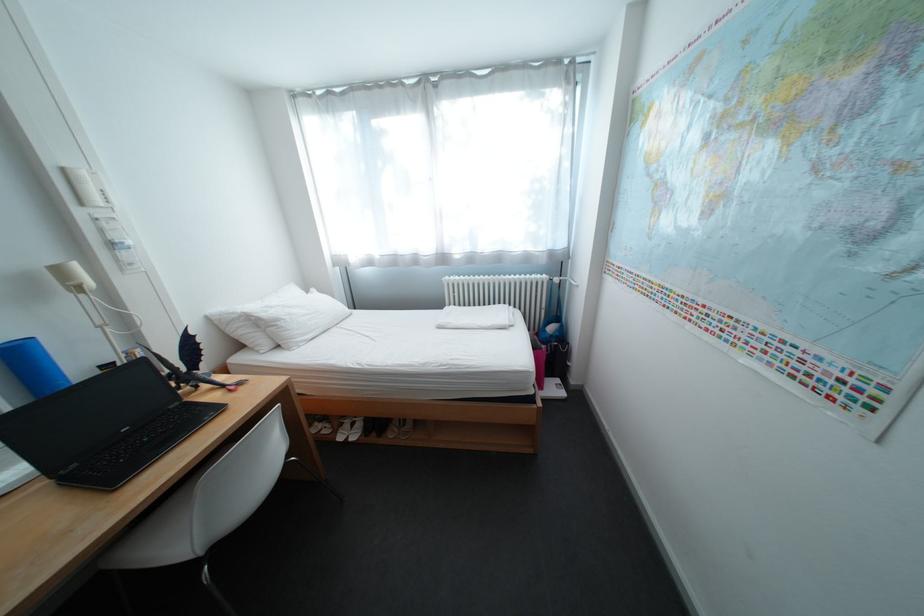
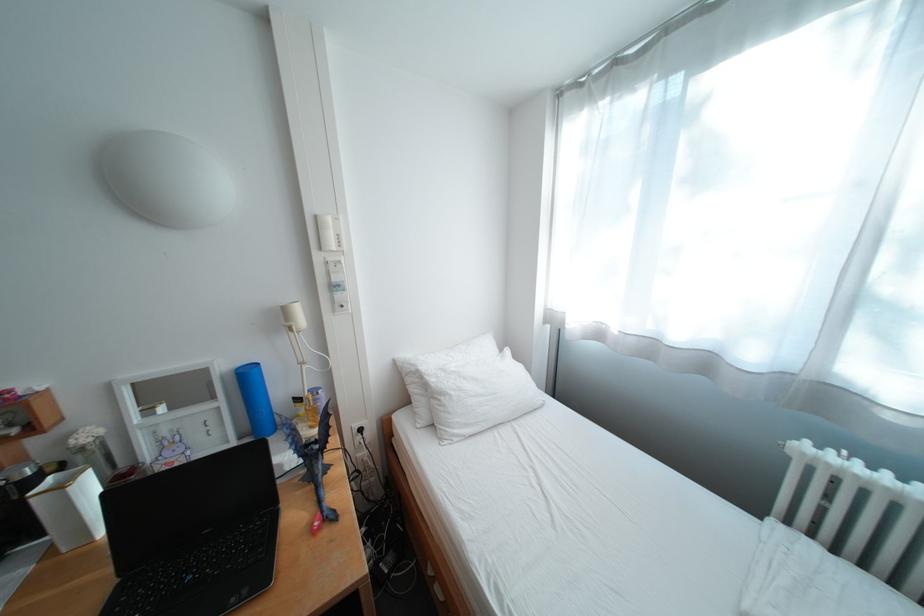
Question: The camera is either moving clockwise (left) or counter-clockwise (right) around the object. The first image is from the beginning of the video and the second image is from the end. Is the camera moving left or right when shooting the video?

Choices:
 (A) Left
 (B) Right

Answer: (B)